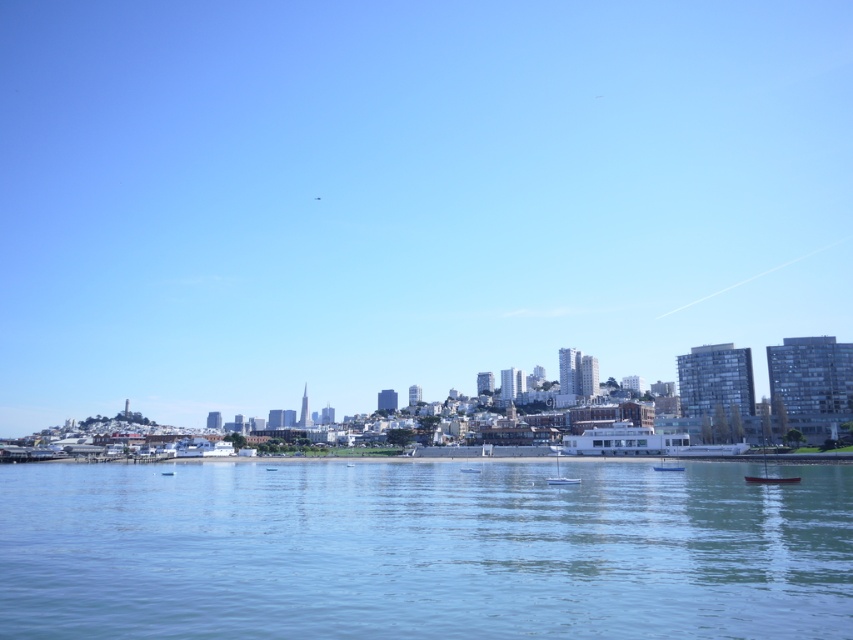
Does transparent glass skyline at center have a lesser width compared to white glossy boat at center?

In fact, transparent glass skyline at center might be wider than white glossy boat at center.

I want to click on transparent glass skyline at center, so click(x=407, y=195).

Between point (315, 65) and point (550, 481), which one is positioned behind?

The point (315, 65) is more distant.

This screenshot has width=853, height=640. In order to click on transparent glass skyline at center in this screenshot , I will do `click(407, 195)`.

Can you confirm if transparent glass skyline at center is positioned below white glossy boat at lower center?

Incorrect, transparent glass skyline at center is not positioned below white glossy boat at lower center.

Measure the distance between transparent glass skyline at center and camera.

transparent glass skyline at center is 135.00 meters from camera.

Where is `transparent glass skyline at center`? transparent glass skyline at center is located at coordinates (407, 195).

Is clear blue water at center positioned in front of white glossy boat at center?

Yes, it is.

Does clear blue water at center come behind white glossy boat at center?

No.

Which is behind, point (393, 486) or point (558, 456)?

The point (558, 456) is more distant.

At what (x,y) coordinates should I click in order to perform the action: click on clear blue water at center. Please return your answer as a coordinate pair (x, y). The image size is (853, 640). Looking at the image, I should click on coord(422,550).